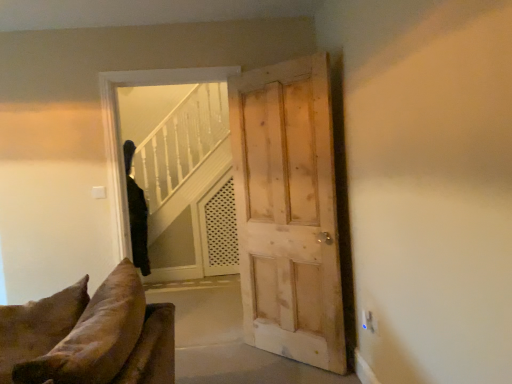
Question: Is light brown wooden door at center outside transparent glass door at center?

Choices:
 (A) no
 (B) yes

Answer: (B)

Question: Considering the relative sizes of light brown wooden door at center and transparent glass door at center in the image provided, is light brown wooden door at center bigger than transparent glass door at center?

Choices:
 (A) yes
 (B) no

Answer: (B)

Question: From a real-world perspective, does light brown wooden door at center sit lower than transparent glass door at center?

Choices:
 (A) no
 (B) yes

Answer: (B)

Question: Is the depth of light brown wooden door at center less than that of transparent glass door at center?

Choices:
 (A) yes
 (B) no

Answer: (A)

Question: Can you see light brown wooden door at center touching transparent glass door at center?

Choices:
 (A) yes
 (B) no

Answer: (B)

Question: Is transparent glass door at center located within light brown wooden door at center?

Choices:
 (A) yes
 (B) no

Answer: (B)

Question: Can you confirm if light brown wooden door at center is positioned to the left of black fabric coat at upper left?

Choices:
 (A) no
 (B) yes

Answer: (A)

Question: From the image's perspective, does light brown wooden door at center appear higher than black fabric coat at upper left?

Choices:
 (A) yes
 (B) no

Answer: (A)

Question: Is light brown wooden door at center further to the viewer compared to black fabric coat at upper left?

Choices:
 (A) yes
 (B) no

Answer: (B)

Question: Is light brown wooden door at center oriented towards black fabric coat at upper left?

Choices:
 (A) no
 (B) yes

Answer: (A)

Question: Does light brown wooden door at center have a lesser height compared to black fabric coat at upper left?

Choices:
 (A) no
 (B) yes

Answer: (A)

Question: Is light brown wooden door at center facing away from black fabric coat at upper left?

Choices:
 (A) no
 (B) yes

Answer: (A)

Question: Does black fabric coat at upper left have a lesser width compared to transparent glass door at center?

Choices:
 (A) yes
 (B) no

Answer: (B)